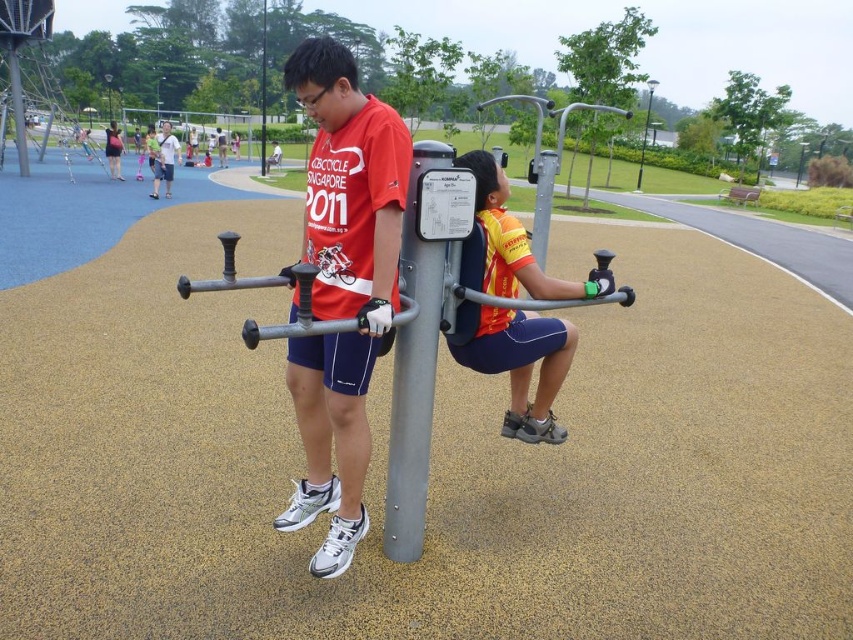
Can you confirm if matte red shirt at center is positioned above white cotton shirt at upper left?

Incorrect, matte red shirt at center is not positioned above white cotton shirt at upper left.

Which is behind, point (305, 342) or point (161, 163)?

Positioned behind is point (161, 163).

You are a GUI agent. You are given a task and a screenshot of the screen. Output one action in this format:
    pyautogui.click(x=<x>, y=<y>)
    Task: Click on the matte red shirt at center
    
    Given the screenshot: What is the action you would take?
    pyautogui.click(x=341, y=285)

Is matte red shirt at center thinner than brushed metal pole at center?

Indeed, matte red shirt at center has a lesser width compared to brushed metal pole at center.

Between matte red shirt at center and brushed metal pole at center, which one is positioned lower?

Positioned lower is matte red shirt at center.

This screenshot has width=853, height=640. What do you see at coordinates (341, 285) in the screenshot? I see `matte red shirt at center` at bounding box center [341, 285].

Identify the location of matte red shirt at center. The height and width of the screenshot is (640, 853). (341, 285).

Locate an element on the screen. The image size is (853, 640). yellow fabric vest at center is located at coordinates (521, 365).

Between yellow fabric vest at center and brushed metal pole at center, which one appears on the left side from the viewer's perspective?

From the viewer's perspective, brushed metal pole at center appears more on the left side.

At what (x,y) coordinates should I click in order to perform the action: click on yellow fabric vest at center. Please return your answer as a coordinate pair (x, y). This screenshot has width=853, height=640. Looking at the image, I should click on (521, 365).

At what (x,y) coordinates should I click in order to perform the action: click on yellow fabric vest at center. Please return your answer as a coordinate pair (x, y). The image size is (853, 640). Looking at the image, I should click on (521, 365).